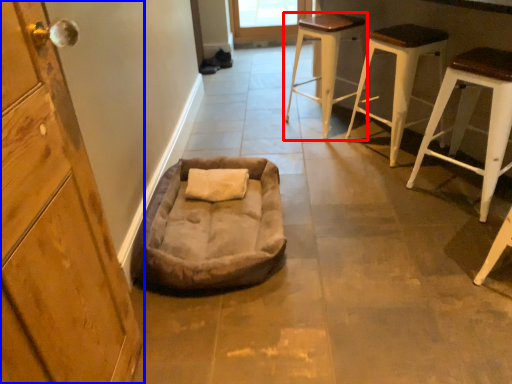
Question: Among these objects, which one is nearest to the camera, stool (highlighted by a red box) or cabinetry (highlighted by a blue box)?

Choices:
 (A) stool
 (B) cabinetry

Answer: (B)